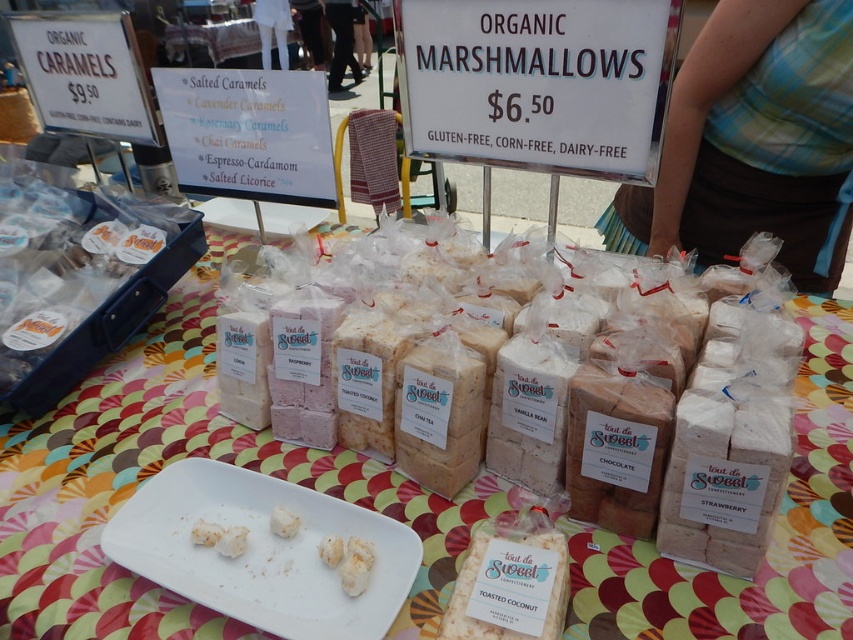
Is white paper sign at upper center thinner than white fluffy marshmallow at center?

No, white paper sign at upper center is not thinner than white fluffy marshmallow at center.

Can you confirm if white paper sign at upper center is wider than white fluffy marshmallow at center?

Indeed, white paper sign at upper center has a greater width compared to white fluffy marshmallow at center.

Identify the location of white paper sign at upper center. The image size is (853, 640). (537, 83).

Consider the image. Who is lower down, matte white chocolate at left or white fluffy marshmallow at center?

white fluffy marshmallow at center is lower down.

Is matte white chocolate at left taller than white fluffy marshmallow at center?

Correct, matte white chocolate at left is much taller as white fluffy marshmallow at center.

Is point (55, 305) in front of point (270, 518)?

That is False.

Find the location of a particular element. matte white chocolate at left is located at coordinates (64, 262).

Can you confirm if polka dot fabric at center is bigger than white fluffy marshmallow at center?

Correct, polka dot fabric at center is larger in size than white fluffy marshmallow at center.

Which is more to the left, polka dot fabric at center or white fluffy marshmallow at center?

white fluffy marshmallow at center is more to the left.

Which is behind, point (445, 500) or point (283, 524)?

Positioned behind is point (445, 500).

The width and height of the screenshot is (853, 640). Identify the location of polka dot fabric at center. (165, 465).